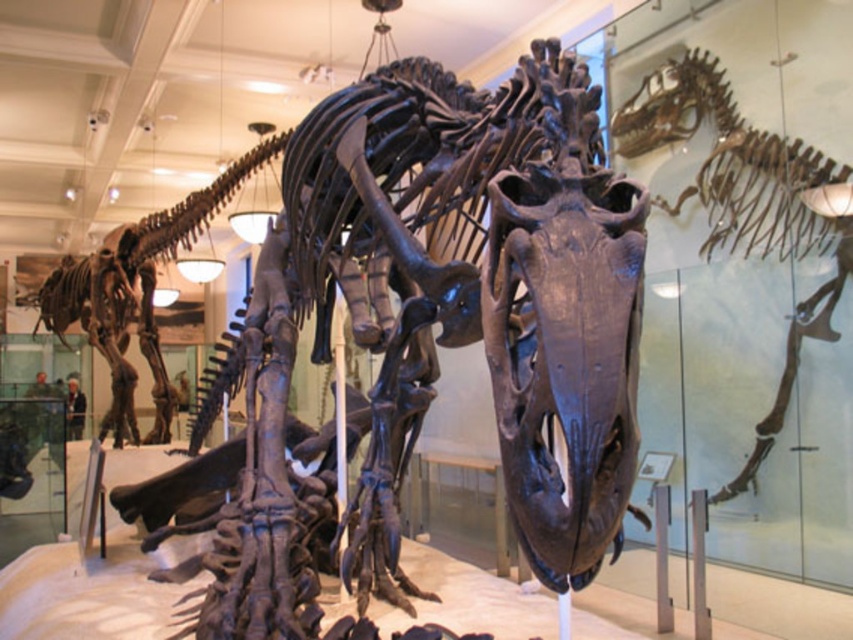
Who is higher up, brown bone-like skull at center or shiny metallic dinosaur at center?

brown bone-like skull at center

Can you confirm if brown bone-like skull at center is wider than shiny metallic dinosaur at center?

No.

Describe the element at coordinates (746, 202) in the screenshot. This screenshot has height=640, width=853. I see `brown bone-like skull at center` at that location.

You are a GUI agent. You are given a task and a screenshot of the screen. Output one action in this format:
    pyautogui.click(x=<x>, y=<y>)
    Task: Click on the brown bone-like skull at center
    The image size is (853, 640).
    Given the screenshot: What is the action you would take?
    pyautogui.click(x=746, y=202)